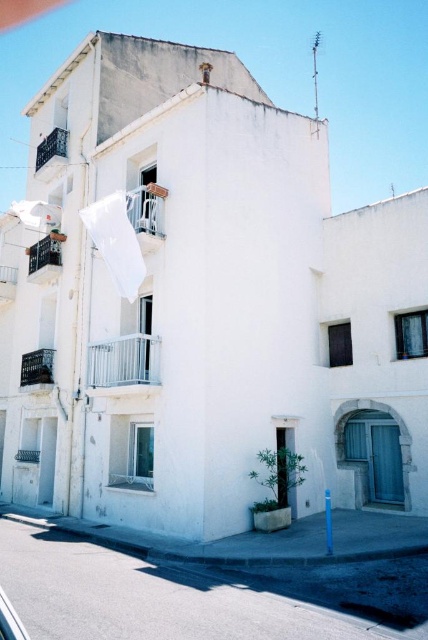
You are an architect evaluating the building structure. You notice two balconies on the upper left side of the building. Which one is taller between the white metal balcony at upper left and the metallic balcony at upper left?

The white metal balcony at upper left is much taller than the metallic balcony at upper left according to the description.

You are standing at the entrance of the white building and want to locate the metallic balcony at left. Based on the 2D coordinates provided, where should you look relative to the building?

The metallic balcony at left is located at the coordinates point (44, 257), which means it is positioned approximately 40.2 percent from the left edge and 10.5 percent from the bottom edge of the building facade.

You are an architect reviewing a building design. You notice two metallic balconies in the image. The first is labeled as the metallic balcony at left, and the second is the metallic balcony at upper left. Based on the building design, which of these two balconies has a greater height dimension?

The metallic balcony at left is much taller than the metallic balcony at upper left according to the building design.